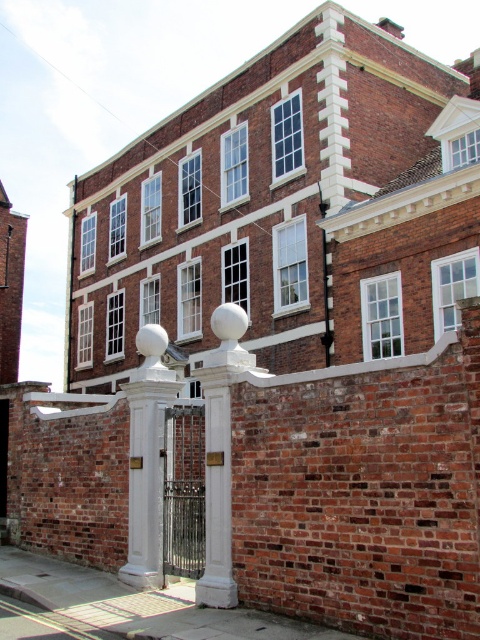
You are a visitor approaching the entrance of the brick building and see both the white polished stone pillar at center and the white glossy pillar at center. Which pillar is bigger in size?

The white polished stone pillar at center has a larger size compared to the white glossy pillar at center.

You are a delivery person trying to enter the property through the gate. There are two pillars in front of you, a white polished stone pillar at center and a white glossy pillar at center. The distance between them is crucial for your delivery truck to pass. Can you confirm if the space between the two pillars is wide enough for your truck, which is 10 feet wide?

The white polished stone pillar at center and white glossy pillar at center are 10.71 feet apart from each other. Since the truck is 10 feet wide, there is enough space for it to pass through the gap between the two pillars.

You are standing in front of a brick building with a low wall and ornamental fence. There is a point marked at coordinates (146, 458). Based on the scene description, can you determine which object this point is located on?

The point at (146, 458) is located on the white polished stone pillar at center.